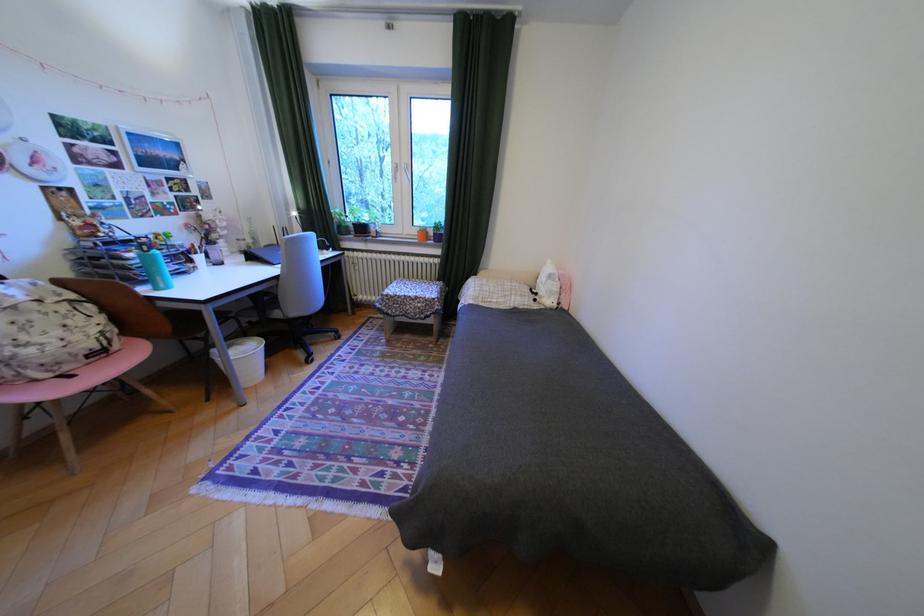
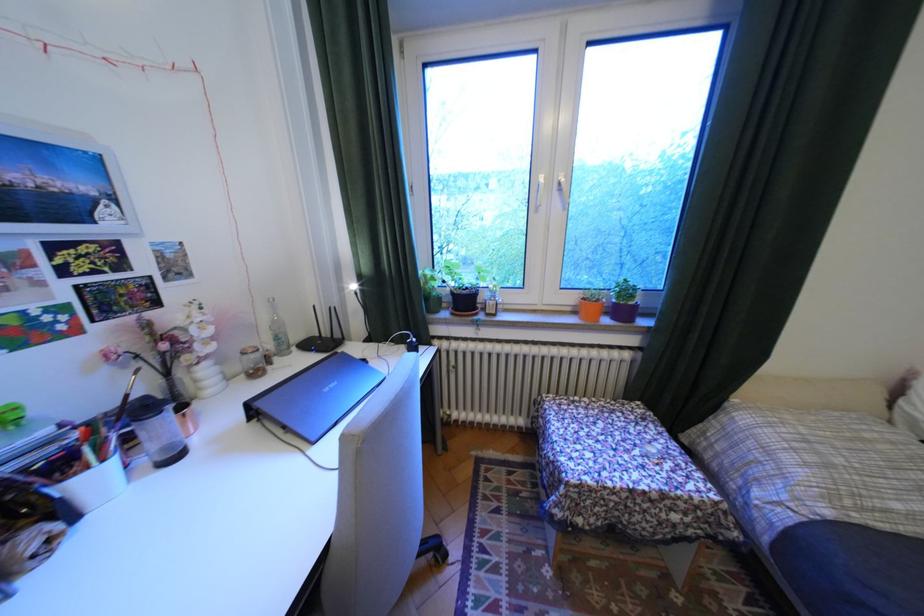
Which direction would the cameraman need to move to produce the second image?

The cameraman moved toward left, forward.